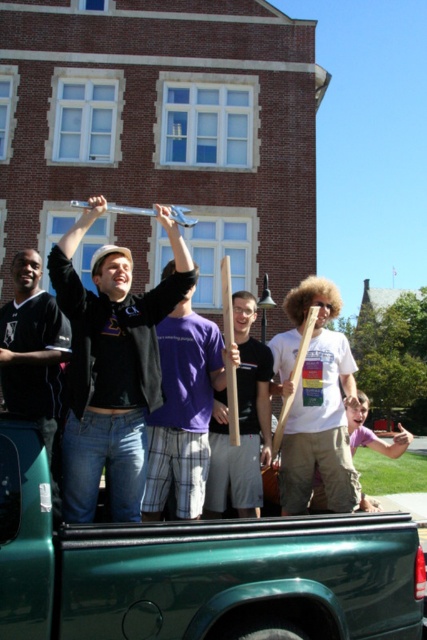
You are a photographer trying to capture a candid shot of the matte black shirt at left and the wooden pole at center. Based on their positions, which object is higher in the frame?

The matte black shirt at left is above the wooden pole at center, so it is higher in the frame.

You are a photographer trying to capture the metallic silver plectrum at upper center in the center of your photo. Based on its current position at point (x=111, y=365), should you move your camera to the left or right to center it?

The metallic silver plectrum at upper center is already located at point (x=111, y=365), which is the center of the image. Therefore, you do not need to move the camera left or right to center it.

Looking at this image, you are a photographer trying to capture the metallic silver plectrum at upper center in the center of your photo. Given its current position at point 0.573 on the x axis and 0.262 on the y axis, would you need to move the camera to the left or right to center it horizontally?

The metallic silver plectrum at upper center is located at x coordinate 0.573. Since the center of the image is at x coordinate 0.5, the plectrum is slightly to the right of center. To center it horizontally, you would need to move the camera slightly to the right to bring the plectrum closer to the central x position.